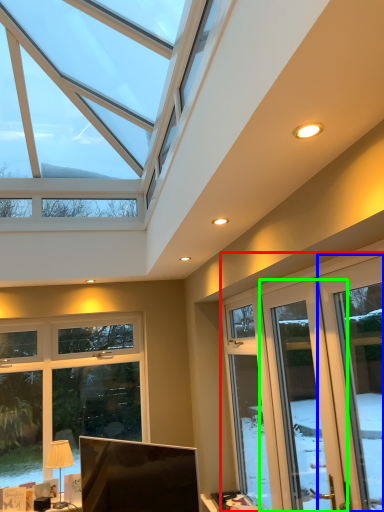
Question: Which object is positioned farthest from screen door (highlighted by a red box)? Select from window (highlighted by a blue box) and screen door (highlighted by a green box).

Choices:
 (A) window
 (B) screen door

Answer: (A)